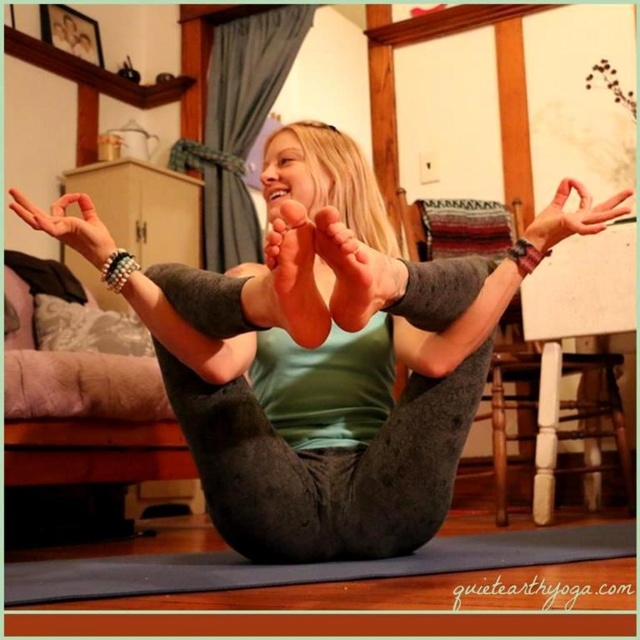
You are standing in the room and want to reach a point that is exactly 90 centimeters away from you. Can you confirm if the point marked as point (317, 243) is within that distance?

The point (317, 243) is 90.25 centimeters away from the viewer, so it is just slightly beyond the 90 centimeter mark. Therefore, it is not within the desired distance.

Looking at this image, based on the scene description, where is the matte gray foot at center located in the image? Please provide the coordinates in the format of a point like this example format for reference only, not part of the answer. The answer should be in the form of a point like this example format for reference only, not part of the answer. The answer should be in the form of a point like this example format for reference only, not part of the answer. The answer should be in the form of a point like this example format

The matte gray foot at center is located at point coordinates of (355, 273).